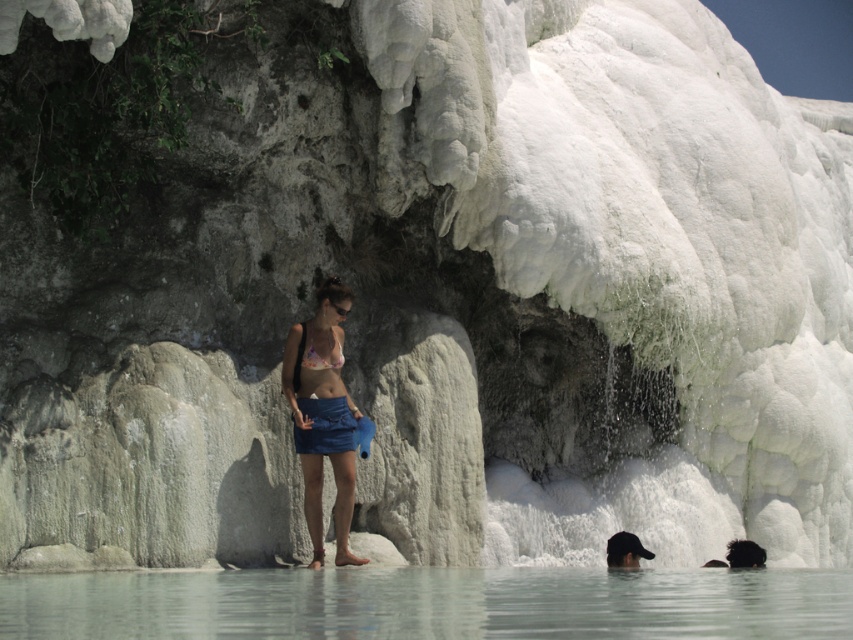
Is clear water at lower center smaller than blue fabric skirt at center?

No, clear water at lower center is not smaller than blue fabric skirt at center.

Between clear water at lower center and blue fabric skirt at center, which one has more height?

Standing taller between the two is blue fabric skirt at center.

The height and width of the screenshot is (640, 853). What are the coordinates of `clear water at lower center` in the screenshot? It's located at (428, 604).

Who is more forward, (651, 596) or (622, 545)?

Point (651, 596) is in front.

Does clear water at lower center appear on the right side of black matte cap at lower center?

In fact, clear water at lower center is to the left of black matte cap at lower center.

Does point (718, 579) come in front of point (622, 545)?

Yes.

Locate an element on the screen. Image resolution: width=853 pixels, height=640 pixels. clear water at lower center is located at coordinates (428, 604).

Based on the photo, is black matte cap at lower center below matte white bikini top at center?

Yes.

Can you confirm if black matte cap at lower center is wider than matte white bikini top at center?

Correct, the width of black matte cap at lower center exceeds that of matte white bikini top at center.

Who is more forward, (624, 563) or (337, 358)?

Point (337, 358) is in front.

Where is `black matte cap at lower center`? The width and height of the screenshot is (853, 640). black matte cap at lower center is located at coordinates (625, 550).